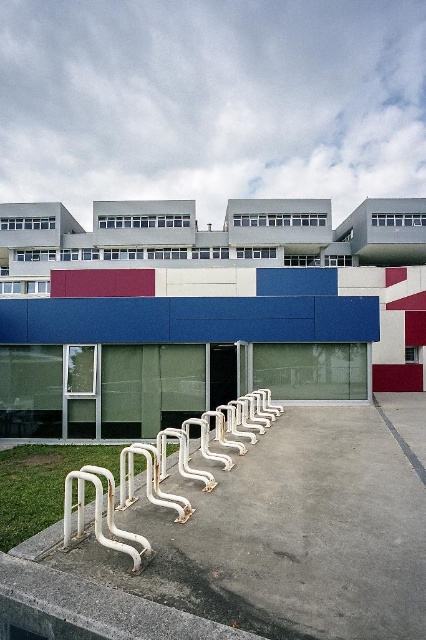
Between white smooth concrete at lower left and white matte rail at lower center, which one appears on the right side from the viewer's perspective?

white smooth concrete at lower left

Is white smooth concrete at lower left above white matte rail at lower center?

No, white smooth concrete at lower left is not above white matte rail at lower center.

At what (x,y) coordinates should I click in order to perform the action: click on white smooth concrete at lower left. Please return your answer as a coordinate pair (x, y). Looking at the image, I should click on (284, 536).

The height and width of the screenshot is (640, 426). In order to click on white smooth concrete at lower left in this screenshot , I will do `click(284, 536)`.

Between white matte rail at lower center and gray concrete line at center, which one appears on the right side from the viewer's perspective?

gray concrete line at center is more to the right.

Who is higher up, white matte rail at lower center or gray concrete line at center?

white matte rail at lower center is higher up.

Describe the element at coordinates (161, 474) in the screenshot. I see `white matte rail at lower center` at that location.

The width and height of the screenshot is (426, 640). What are the coordinates of `white matte rail at lower center` in the screenshot? It's located at (161, 474).

Is point (230, 586) closer to camera compared to point (389, 422)?

Yes, point (230, 586) is in front of point (389, 422).

Who is more forward, (400, 573) or (411, 461)?

Positioned in front is point (400, 573).

Who is more distant from viewer, (403, 600) or (382, 412)?

Point (382, 412)

I want to click on white smooth concrete at lower left, so click(x=284, y=536).